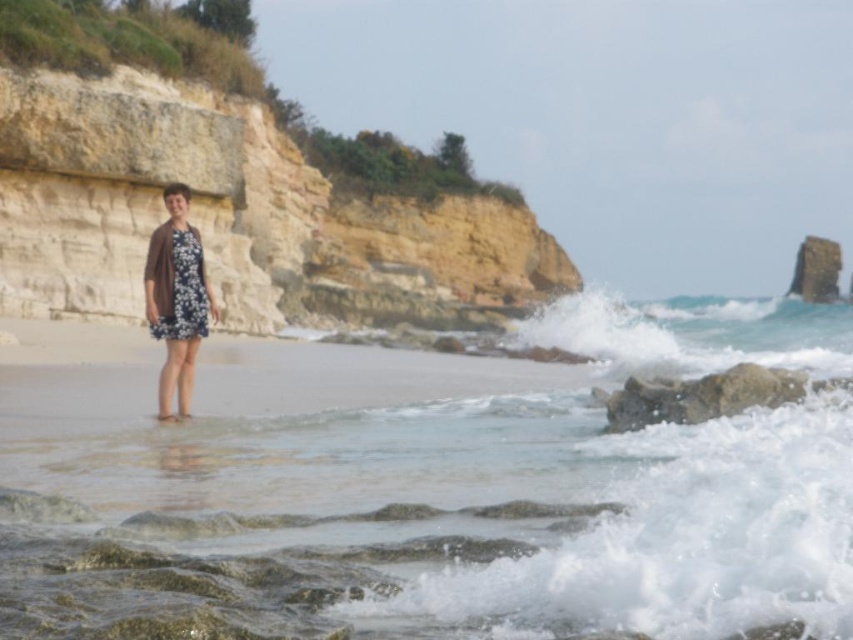
Between smooth sand cliff at center and floral dress at center, which one is positioned higher?

smooth sand cliff at center is higher up.

I want to click on smooth sand cliff at center, so click(x=234, y=186).

Which is behind, point (364, 141) or point (148, 252)?

The point (364, 141) is more distant.

This screenshot has height=640, width=853. I want to click on smooth sand cliff at center, so click(234, 186).

What do you see at coordinates (408, 508) in the screenshot?
I see `clear water at lower left` at bounding box center [408, 508].

Which is more to the right, clear water at lower left or floral dress at center?

clear water at lower left is more to the right.

Does point (228, 392) come behind point (202, 326)?

Yes, point (228, 392) is farther from viewer.

This screenshot has width=853, height=640. What are the coordinates of `clear water at lower left` in the screenshot? It's located at (408, 508).

The height and width of the screenshot is (640, 853). Describe the element at coordinates (408, 508) in the screenshot. I see `clear water at lower left` at that location.

Find the location of `clear water at lower left`. clear water at lower left is located at coordinates (408, 508).